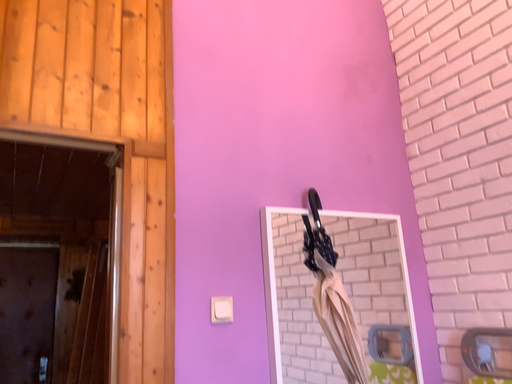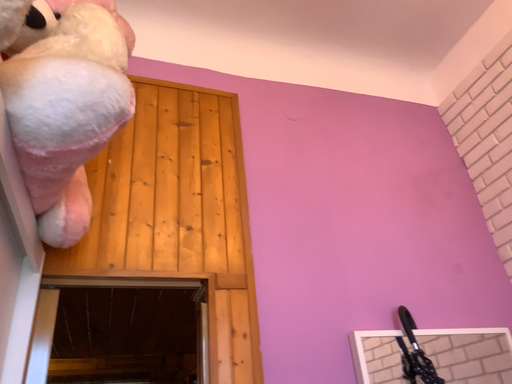
Question: Which way did the camera rotate in the video?

Choices:
 (A) rotated upward
 (B) rotated downward

Answer: (A)